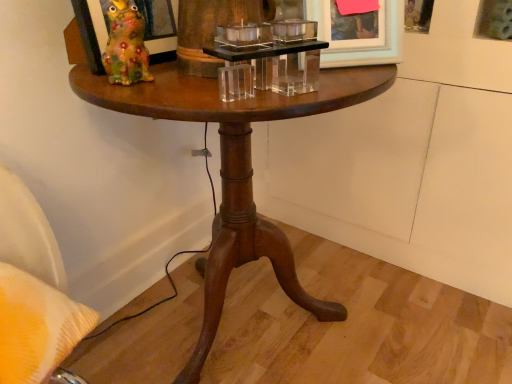
Question: Would you say wooden picture frame at upper right, the first picture frame when ordered from right to left, is to the left or to the right of matte white picture frame at upper right, the 2th picture frame in the right-to-left sequence, in the picture?

Choices:
 (A) right
 (B) left

Answer: (A)

Question: Considering the positions of wooden picture frame at upper right, the first picture frame when ordered from right to left, and matte white picture frame at upper right, the 2th picture frame in the right-to-left sequence, in the image, is wooden picture frame at upper right, the first picture frame when ordered from right to left, bigger or smaller than matte white picture frame at upper right, the 2th picture frame in the right-to-left sequence,?

Choices:
 (A) small
 (B) big

Answer: (B)

Question: Based on their relative distances, which object is nearer to the wooden pedestal table at center?

Choices:
 (A) matte white picture frame at upper right, which is counted as the second picture frame, starting from the left
 (B) wooden picture frame at upper right, the first picture frame when ordered from right to left
 (C) matte ceramic frog at upper left, which is the 1th picture frame in left-to-right order
 (D) clear acrylic candle holder at center

Answer: (D)

Question: Considering the real-world distances, which object is closest to the wooden picture frame at upper right, positioned as the third picture frame in left-to-right order?

Choices:
 (A) matte ceramic frog at upper left, which is the 1th picture frame in left-to-right order
 (B) clear acrylic candle holder at center
 (C) wooden pedestal table at center
 (D) matte white picture frame at upper right, which is counted as the second picture frame, starting from the left

Answer: (D)